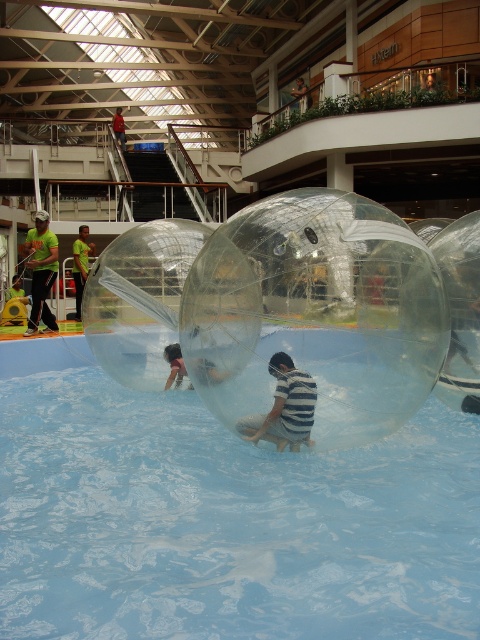
Question: Where is transparent plastic swimming pool at center located in relation to green fabric shirt at left in the image?

Choices:
 (A) below
 (B) above

Answer: (A)

Question: Considering the real-world distances, which object is closest to the green fabric shirt at left?

Choices:
 (A) transparent/inflatable bubble at center
 (B) striped fabric person at center
 (C) smooth skin person at upper center
 (D) green t-shirt at upper center

Answer: (A)

Question: Which point is closer to the camera?

Choices:
 (A) transparent/inflatable bubble at center
 (B) green t-shirt at upper center

Answer: (A)

Question: Which of the following is the closest to the observer?

Choices:
 (A) (49, 316)
 (B) (176, 612)
 (C) (298, 77)
 (D) (117, 131)

Answer: (B)

Question: Is transparent plastic swimming pool at center bigger than smooth skin person at upper center?

Choices:
 (A) no
 (B) yes

Answer: (A)

Question: Does smooth skin person at upper center have a larger size compared to green t-shirt at upper center?

Choices:
 (A) no
 (B) yes

Answer: (B)